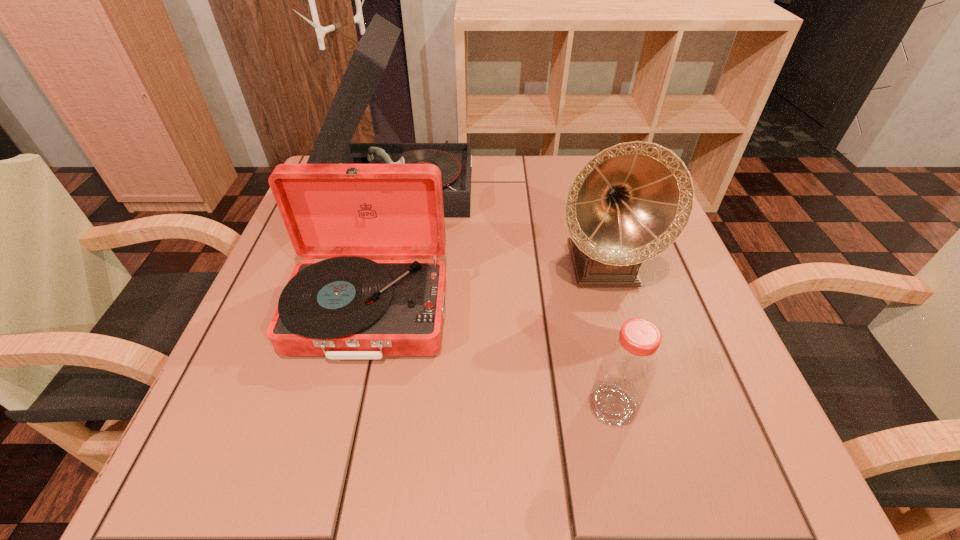
You are a GUI agent. You are given a task and a screenshot of the screen. Output one action in this format:
    pyautogui.click(x=<x>, y=<y>)
    Task: Click on the object that is at the far edge
    This screenshot has height=540, width=960.
    Given the screenshot: What is the action you would take?
    pyautogui.click(x=369, y=60)

This screenshot has width=960, height=540. Find the location of `object positioned at the near edge`. object positioned at the near edge is located at coordinates (627, 369).

At what (x,y) coordinates should I click in order to perform the action: click on object positioned at the right edge. Please return your answer as a coordinate pair (x, y). The width and height of the screenshot is (960, 540). Looking at the image, I should click on (629, 203).

Where is `object located at the far left corner`? This screenshot has height=540, width=960. object located at the far left corner is located at coordinates (369, 60).

I want to click on vacant area at the far edge of the desktop, so click(x=478, y=178).

Image resolution: width=960 pixels, height=540 pixels. Find the location of `free space at the near edge`. free space at the near edge is located at coordinates (531, 460).

The image size is (960, 540). I want to click on free space at the left edge of the desktop, so click(x=267, y=326).

At what (x,y) coordinates should I click in order to perform the action: click on free space at the right edge. Please return your answer as a coordinate pair (x, y). Looking at the image, I should click on (648, 299).

Locate an element on the screen. empty location between the nearest object and the rightmost phonograph_record is located at coordinates (607, 335).

Where is `free space between the farthest object and the bottle`? This screenshot has width=960, height=540. free space between the farthest object and the bottle is located at coordinates (506, 295).